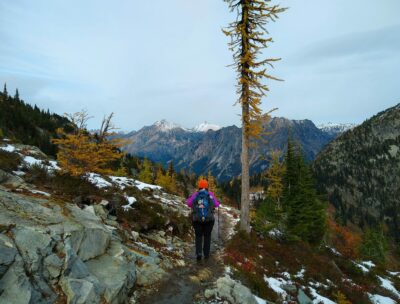
Identify the location of rod. Image resolution: width=400 pixels, height=304 pixels. (218, 230).